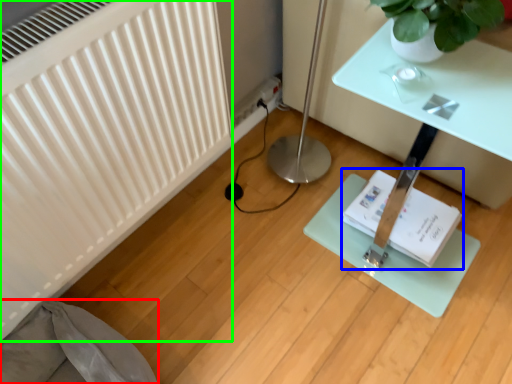
Question: Based on their relative distances, which object is nearer to swivel chair (highlighted by a red box)? Choose from book (highlighted by a blue box) and radiator (highlighted by a green box).

Choices:
 (A) book
 (B) radiator

Answer: (B)